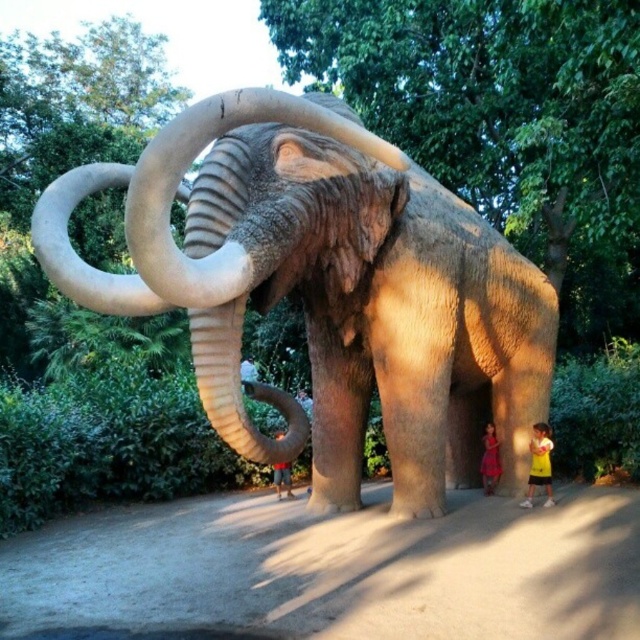
Question: Can you confirm if pink fabric dress at lower right is wider than light blue jeans at center?

Choices:
 (A) yes
 (B) no

Answer: (B)

Question: Which point is farther to the camera?

Choices:
 (A) (500, 468)
 (B) (536, 484)
 (C) (339, 204)
 (D) (256, 381)

Answer: (A)

Question: Does smooth gray elephant at center have a larger size compared to white fabric shirt at center?

Choices:
 (A) yes
 (B) no

Answer: (A)

Question: Is yellow cotton shirt at lower right closer to the viewer compared to white fabric shirt at center?

Choices:
 (A) yes
 (B) no

Answer: (A)

Question: Which of the following is the farthest from the observer?

Choices:
 (A) (257, 376)
 (B) (276, 486)
 (C) (436, 253)

Answer: (A)

Question: Which point is farther to the camera?

Choices:
 (A) (288, 477)
 (B) (536, 460)
 (C) (253, 369)
 (D) (488, 435)

Answer: (C)